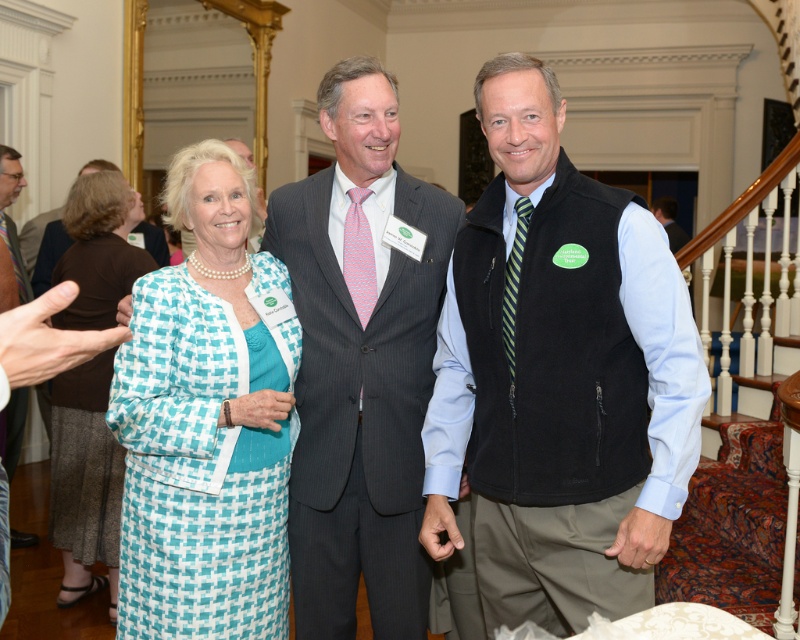
Is black fleece vest at center to the right of teal woven dress at left from the viewer's perspective?

Indeed, black fleece vest at center is positioned on the right side of teal woven dress at left.

Is point (554, 154) in front of point (158, 621)?

Yes, it is in front of point (158, 621).

Where is `black fleece vest at center`? black fleece vest at center is located at coordinates (558, 376).

The height and width of the screenshot is (640, 800). Identify the location of black fleece vest at center. (558, 376).

What are the coordinates of `black fleece vest at center` in the screenshot? It's located at click(x=558, y=376).

Between black fleece vest at center and teal houndstooth dress at center, which one has more height?

Standing taller between the two is teal houndstooth dress at center.

Is point (472, 330) positioned after point (64, 506)?

No.

At what (x,y) coordinates should I click in order to perform the action: click on black fleece vest at center. Please return your answer as a coordinate pair (x, y). This screenshot has height=640, width=800. Looking at the image, I should click on (558, 376).

Is teal houndstooth dress at center below striped tie at left?

Yes.

Measure the distance between point (100,289) and camera.

The distance of point (100,289) from camera is 3.16 meters.

The height and width of the screenshot is (640, 800). Describe the element at coordinates (84, 477) in the screenshot. I see `teal houndstooth dress at center` at that location.

The width and height of the screenshot is (800, 640). I want to click on teal houndstooth dress at center, so point(84,477).